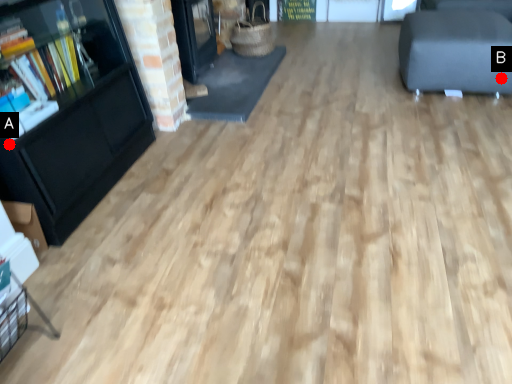
Question: Two points are circled on the image, labeled by A and B beside each circle. Which point is farther from the camera taking this photo?

Choices:
 (A) A is further
 (B) B is further

Answer: (B)